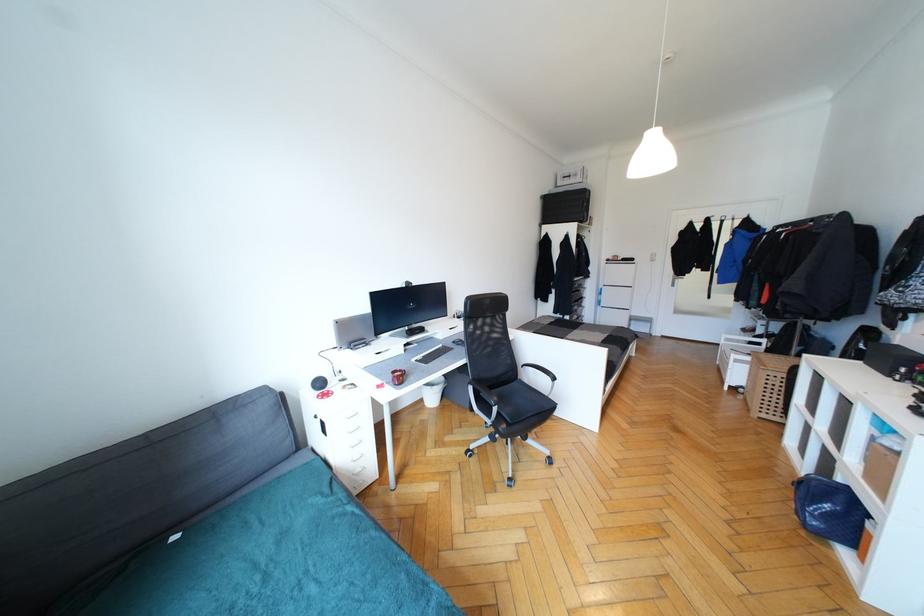
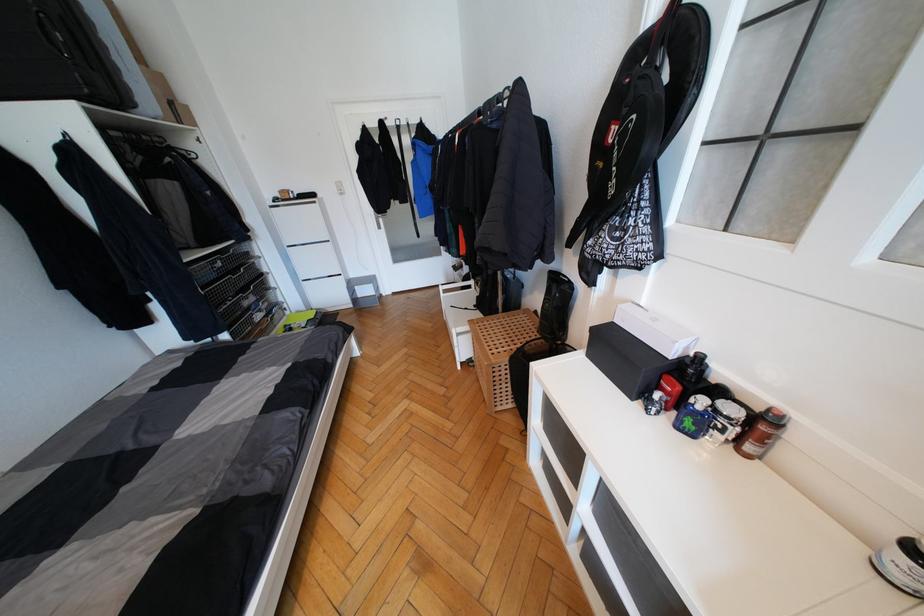
Locate, in the second image, the point that corresponds to [749,368] in the first image.

(472, 338)